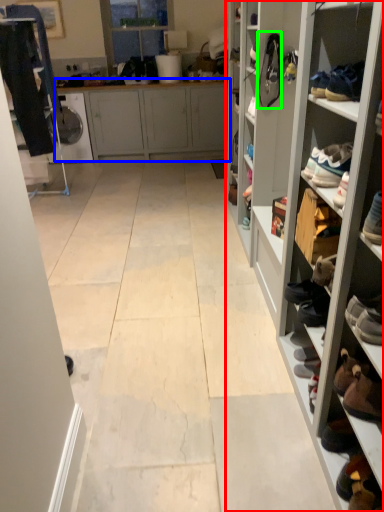
Question: Estimate the real-world distances between objects in this image. Which object is closer to shelf (highlighted by a red box), cabinetry (highlighted by a blue box) or shoe (highlighted by a green box)?

Choices:
 (A) cabinetry
 (B) shoe

Answer: (B)